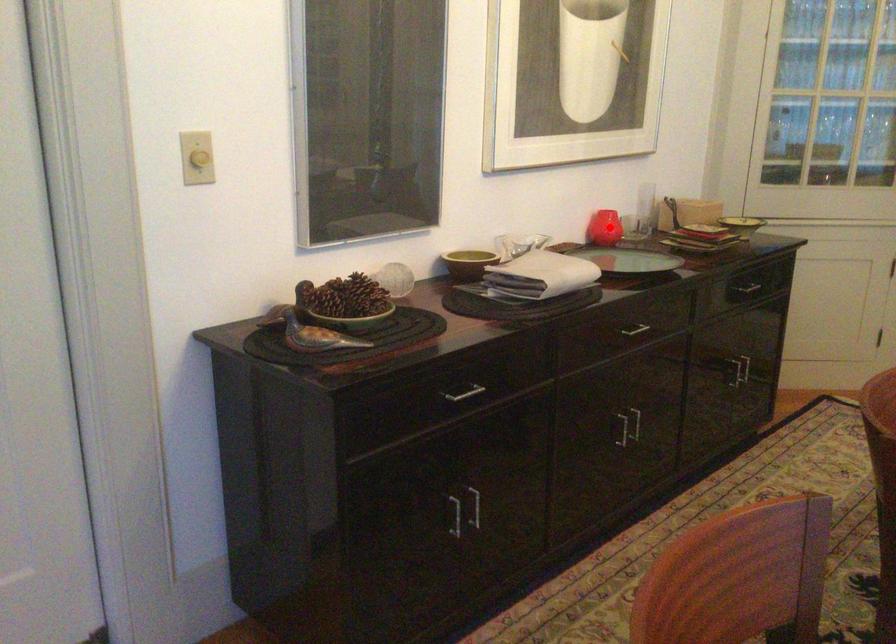
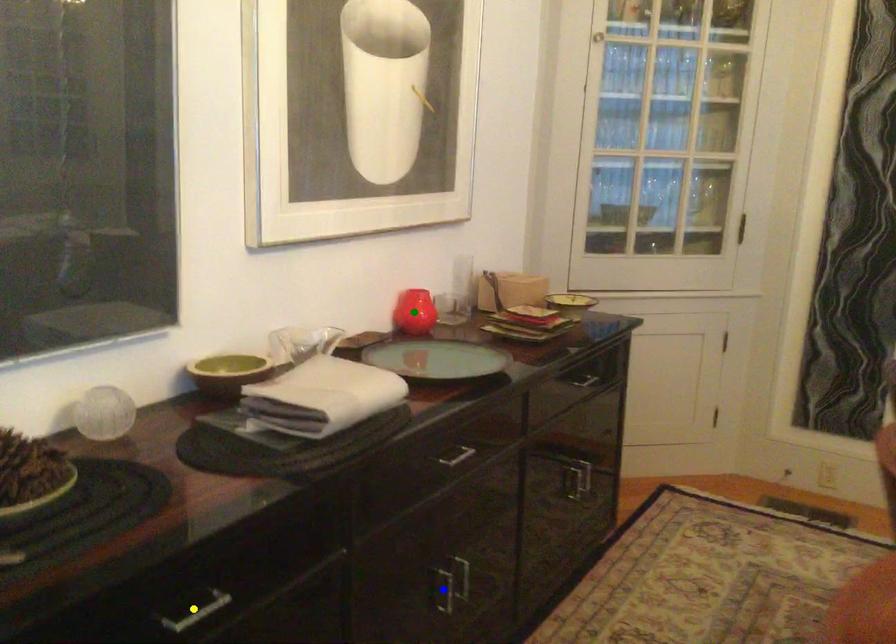
Question: I am providing you with two images of the same scene from different viewpoints. A red point is marked on the first image. You are given multiple points on the second image. Which mark in image 2 goes with the point in image 1?

Choices:
 (A) yellow point
 (B) green point
 (C) blue point

Answer: (B)